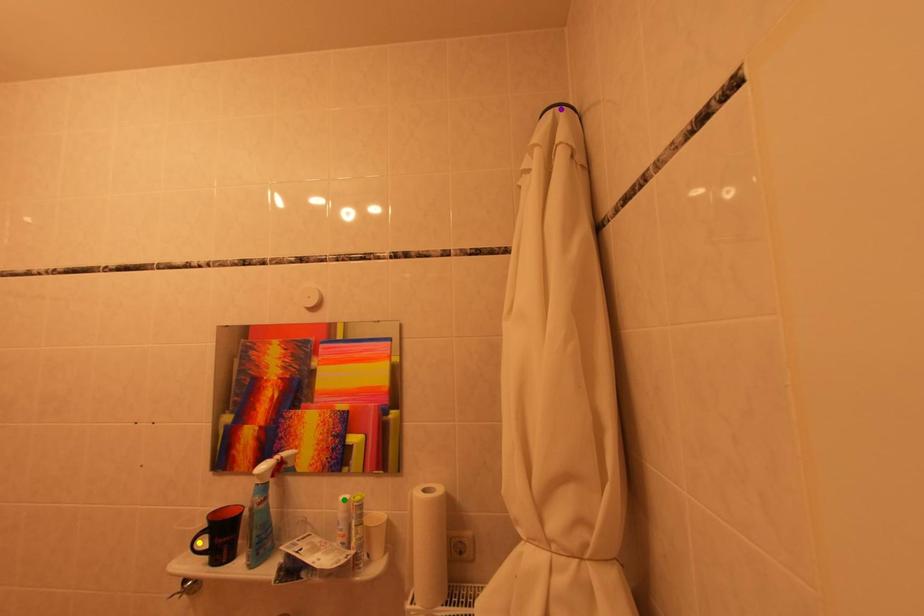
Order these from nearest to farthest:
yellow point | green point | purple point

yellow point, purple point, green point